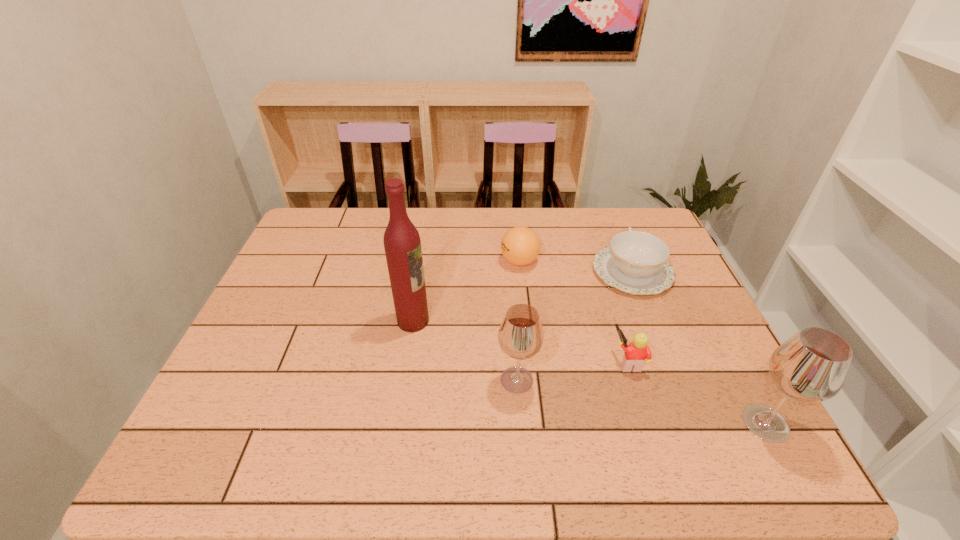
What are the coordinates of `vacant space in between the tallest object and the right wineglass` in the screenshot? It's located at (589, 372).

Where is `vacant area between the ping-pong ball and the leftmost object`? The image size is (960, 540). vacant area between the ping-pong ball and the leftmost object is located at coordinates pyautogui.click(x=467, y=291).

Select which object appears as the second closest to the Lego. Please provide its 2D coordinates. Your answer should be formatted as a tuple, i.e. [(x, y)], where the tuple contains the x and y coordinates of a point satisfying the conditions above.

[(635, 262)]

Locate which object ranks second in proximity to the leftmost object. Please provide its 2D coordinates. Your answer should be formatted as a tuple, i.e. [(x, y)], where the tuple contains the x and y coordinates of a point satisfying the conditions above.

[(520, 245)]

Where is `free space that satisfies the following two spatial constraints: 1. on the label of the tallest object; 2. on the left side of the fourth shortest object`? free space that satisfies the following two spatial constraints: 1. on the label of the tallest object; 2. on the left side of the fourth shortest object is located at coordinates (404, 380).

Where is `free location that satisfies the following two spatial constraints: 1. on the back side of the third tallest object; 2. on the label of the liquor`? free location that satisfies the following two spatial constraints: 1. on the back side of the third tallest object; 2. on the label of the liquor is located at coordinates (513, 321).

Locate an element on the screen. The image size is (960, 540). vacant position in the image that satisfies the following two spatial constraints: 1. on the side with brand of the ping-pong ball; 2. on the left side of the fifth shortest object is located at coordinates (537, 423).

Locate an element on the screen. This screenshot has width=960, height=540. free space that satisfies the following two spatial constraints: 1. on the label of the tallest object; 2. on the right side of the fourth shortest object is located at coordinates (404, 380).